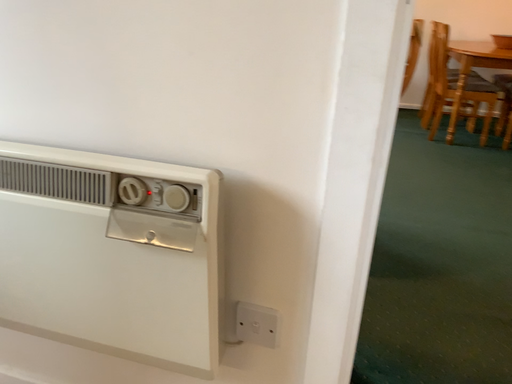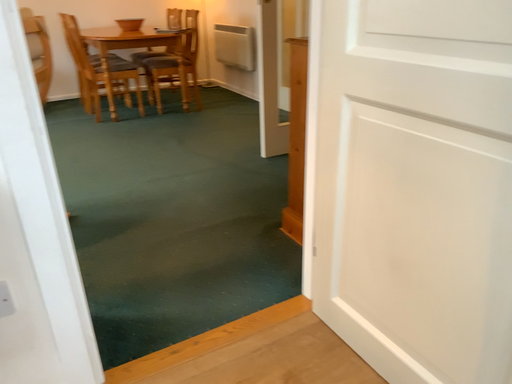
Question: How did the camera likely rotate when shooting the video?

Choices:
 (A) rotated downward
 (B) rotated upward

Answer: (B)